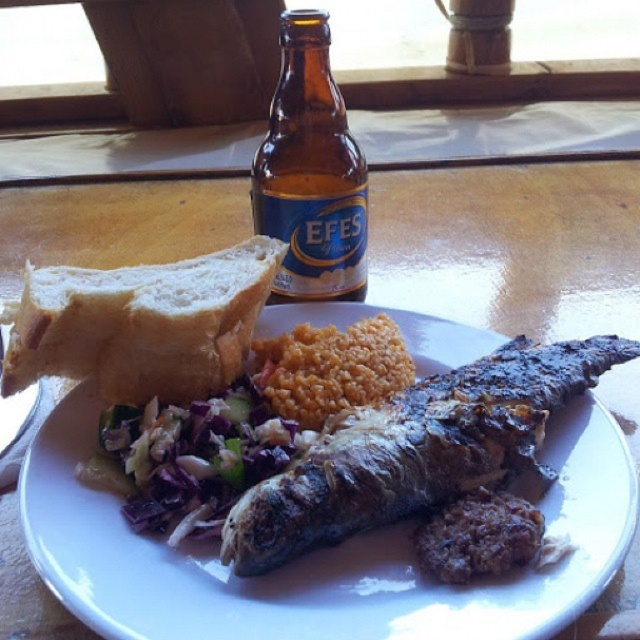
You are a food critic evaluating the arrangement of the meal. The white ceramic plate at center and shredded purple cabbage at center are part of the dish. Based on their positions, which item is placed higher on the plate?

The shredded purple cabbage at center is higher than the white ceramic plate at center because the plate is below the cabbage.

You are a chef arranging a meal on a white ceramic plate at center. You want to add more shredded purple cabbage at center without making it overflow. What should you do?

The white ceramic plate at center is much taller than the shredded purple cabbage at center, so you can add more shredded purple cabbage at center without causing overflow since the plate has sufficient vertical space.

You are a chef arranging a meal on a white ceramic plate at center. You want to place a white soft bread at upper left on the table without overlapping the plate. Can you fit it there based on their sizes?

The white ceramic plate at center is wider than the white soft bread at upper left, so there should be enough space to place the white soft bread at upper left on the table without overlapping the plate.